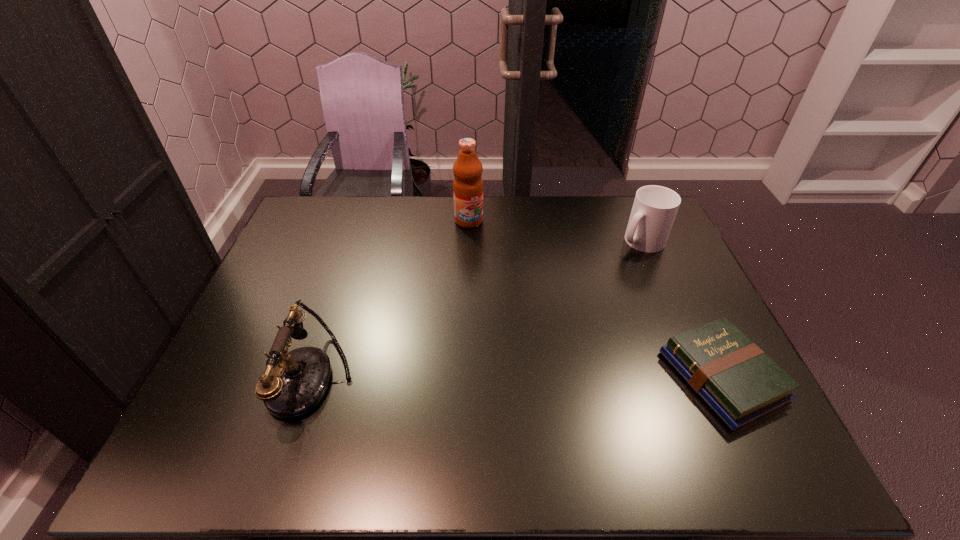
I want to click on vacant area located 0.160m on the handle side of the mug, so click(x=606, y=278).

At what (x,y) coordinates should I click in order to perform the action: click on vacant space located 0.370m on the front label of the third object from right to left. Please return your answer as a coordinate pair (x, y). The image size is (960, 540). Looking at the image, I should click on 516,303.

You are a GUI agent. You are given a task and a screenshot of the screen. Output one action in this format:
    pyautogui.click(x=<x>, y=<y>)
    Task: Click on the blank area located on the front label of the third object from right to left
    
    Given the screenshot: What is the action you would take?
    tap(484, 246)

The width and height of the screenshot is (960, 540). Find the location of `vacant space located 0.070m on the front label of the third object from right to left`. vacant space located 0.070m on the front label of the third object from right to left is located at coordinates point(480,241).

The width and height of the screenshot is (960, 540). Identify the location of mug that is at the far edge. (654, 209).

Locate an element on the screen. This screenshot has width=960, height=540. fruit juice present at the far edge is located at coordinates (468, 185).

At what (x,y) coordinates should I click in order to perform the action: click on telephone that is at the near edge. Please return your answer as a coordinate pair (x, y). This screenshot has width=960, height=540. Looking at the image, I should click on coord(293,385).

At what (x,y) coordinates should I click in order to perform the action: click on book that is at the near edge. Please return your answer as a coordinate pair (x, y). Looking at the image, I should click on (741, 384).

Where is `object at the left edge`? object at the left edge is located at coordinates (293, 385).

The image size is (960, 540). In order to click on book that is at the right edge in this screenshot , I will do `click(741, 384)`.